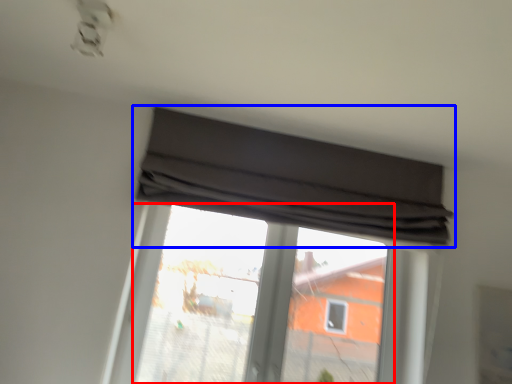
Question: Among these objects, which one is nearest to the camera, bay window (highlighted by a red box) or window (highlighted by a blue box)?

Choices:
 (A) bay window
 (B) window

Answer: (B)